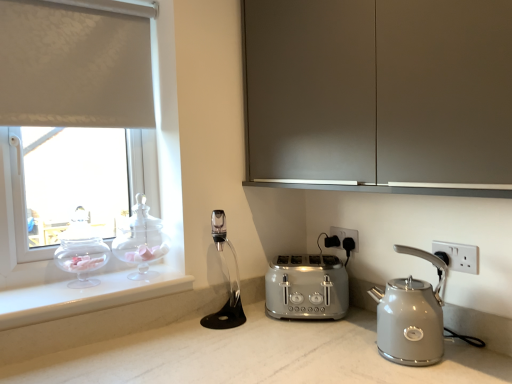
Question: Considering the relative positions of transparent glass teapot at left, which is the 2th tea pot in right-to-left order, and white plastic electric outlet at right, which is counted as the first electric outlet, starting from the front, in the image provided, is transparent glass teapot at left, which is the 2th tea pot in right-to-left order, to the left of white plastic electric outlet at right, which is counted as the first electric outlet, starting from the front, from the viewer's perspective?

Choices:
 (A) no
 (B) yes

Answer: (B)

Question: Considering the relative sizes of transparent glass teapot at left, which is counted as the 1th tea pot, starting from the left, and white plastic electric outlet at right, which ranks as the 2th electric outlet in left-to-right order, in the image provided, is transparent glass teapot at left, which is counted as the 1th tea pot, starting from the left, bigger than white plastic electric outlet at right, which ranks as the 2th electric outlet in left-to-right order,?

Choices:
 (A) no
 (B) yes

Answer: (B)

Question: From the image's perspective, is transparent glass teapot at left, which is the 2th tea pot in right-to-left order, below white plastic electric outlet at right, which is the 2th electric outlet in back-to-front order?

Choices:
 (A) yes
 (B) no

Answer: (B)

Question: Can we say transparent glass teapot at left, which is counted as the 1th tea pot, starting from the left, lies outside white plastic electric outlet at right, which ranks as the 2th electric outlet in left-to-right order?

Choices:
 (A) no
 (B) yes

Answer: (B)

Question: Is transparent glass teapot at left, which is counted as the 1th tea pot, starting from the left, smaller than white plastic electric outlet at right, which is counted as the first electric outlet, starting from the front?

Choices:
 (A) no
 (B) yes

Answer: (A)

Question: Considering the positions of black plastic electric outlet at lower center, placed as the second electric outlet when sorted from front to back, and transparent glass teapot at left, which is the 2th tea pot in right-to-left order, in the image, is black plastic electric outlet at lower center, placed as the second electric outlet when sorted from front to back, taller or shorter than transparent glass teapot at left, which is the 2th tea pot in right-to-left order,?

Choices:
 (A) tall
 (B) short

Answer: (B)

Question: From a real-world perspective, is black plastic electric outlet at lower center, the first electric outlet in the back-to-front sequence, physically located above or below transparent glass teapot at left, which is counted as the 1th tea pot, starting from the left?

Choices:
 (A) below
 (B) above

Answer: (A)

Question: Considering the positions of black plastic electric outlet at lower center, the 2th electric outlet viewed from the right, and transparent glass teapot at left, which is counted as the 1th tea pot, starting from the left, in the image, is black plastic electric outlet at lower center, the 2th electric outlet viewed from the right, wider or thinner than transparent glass teapot at left, which is counted as the 1th tea pot, starting from the left,?

Choices:
 (A) wide
 (B) thin

Answer: (B)

Question: Does point (346, 236) appear closer or farther from the camera than point (101, 254)?

Choices:
 (A) closer
 (B) farther

Answer: (B)

Question: Considering the positions of matte gray cabinet at upper center and satin silver toaster at center in the image, is matte gray cabinet at upper center wider or thinner than satin silver toaster at center?

Choices:
 (A) thin
 (B) wide

Answer: (B)

Question: Is matte gray cabinet at upper center taller or shorter than satin silver toaster at center?

Choices:
 (A) short
 (B) tall

Answer: (B)

Question: From the image's perspective, is matte gray cabinet at upper center located above or below satin silver toaster at center?

Choices:
 (A) below
 (B) above

Answer: (B)

Question: From a real-world perspective, relative to satin silver toaster at center, is matte gray cabinet at upper center vertically above or below?

Choices:
 (A) above
 (B) below

Answer: (A)

Question: Does point (68, 246) appear closer or farther from the camera than point (436, 251)?

Choices:
 (A) closer
 (B) farther

Answer: (B)

Question: In the image, is transparent glass teapot at left, which is the 2th tea pot in right-to-left order, positioned in front of or behind white plastic electric outlet at right, which is the 2th electric outlet in back-to-front order?

Choices:
 (A) front
 (B) behind

Answer: (B)